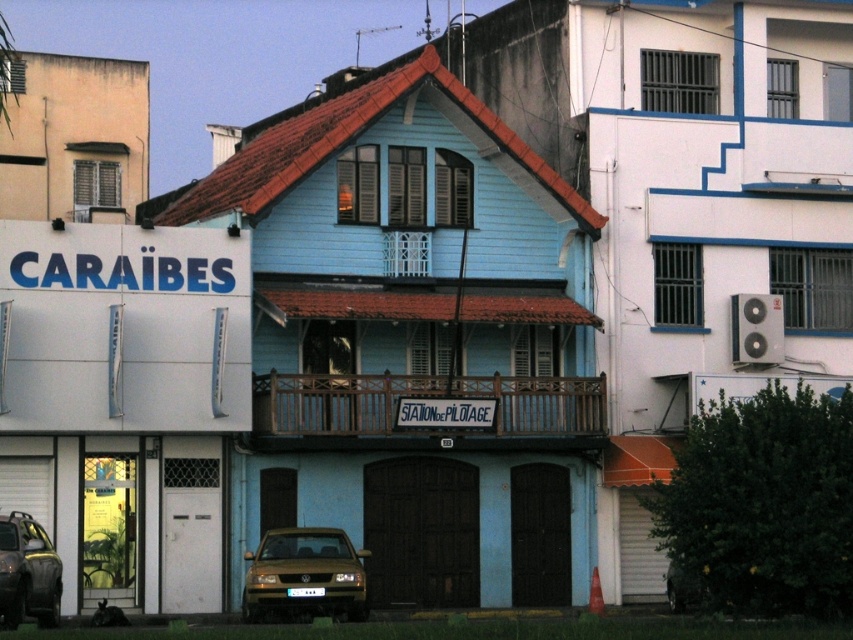
Question: Which object is farther from the camera taking this photo?

Choices:
 (A) metallic gold car at lower left
 (B) gold metallic car at lower center

Answer: (B)

Question: Does gold metallic car at lower center have a greater width compared to metallic gold car at lower left?

Choices:
 (A) yes
 (B) no

Answer: (A)

Question: Does gold metallic car at lower center appear on the left side of metallic gold car at lower left?

Choices:
 (A) yes
 (B) no

Answer: (B)

Question: Does gold metallic car at lower center have a lesser width compared to metallic gold car at lower left?

Choices:
 (A) no
 (B) yes

Answer: (A)

Question: Among these points, which one is nearest to the camera?

Choices:
 (A) (7, 579)
 (B) (283, 544)

Answer: (A)

Question: Which point is closer to the camera?

Choices:
 (A) gold metallic car at lower center
 (B) metallic gold car at lower left

Answer: (B)